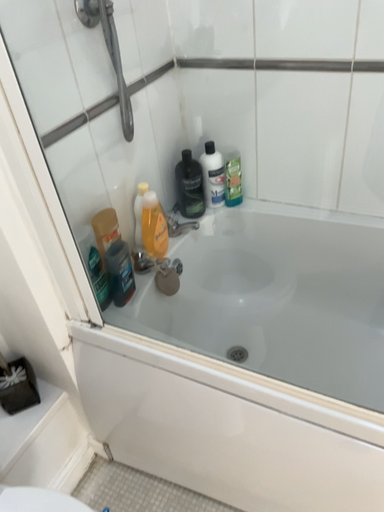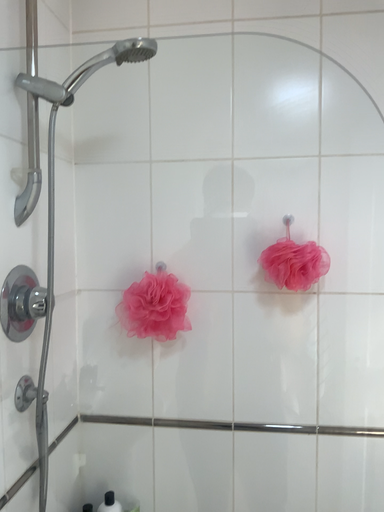
Question: Which way did the camera rotate in the video?

Choices:
 (A) rotated upward
 (B) rotated downward

Answer: (A)